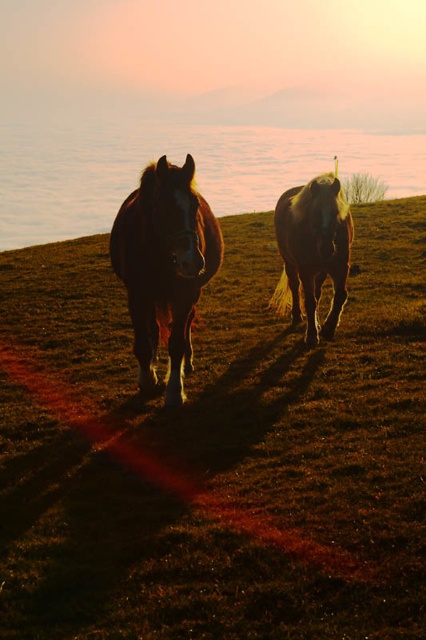
You are standing in the middle of the grassy hill where the two horses are walking. You want to take a photo that includes both points marked as point 1 at (37, 216) and point 2 at (288, 234). Which point should you focus on first to ensure both are in focus?

You should focus on point 1 at (37, 216) first because it is closer to you than point 2 at (288, 234). Since point 1 is closer, focusing on it will ensure that point 2, which is further away, remains in focus as well.

You are a photographer standing in the field. You want to take a photo of the shiny brown horse at right without the translucent glass water at center appearing in the foreground. Is this possible?

The translucent glass water at center is positioned over the shiny brown horse at right, so it will block the view of the horse. Therefore, you cannot take a photo of the shiny brown horse at right without the translucent glass water at center appearing in the foreground.

From the picture: You are a photographer planning to capture the two horses in the scene. Given that you want to focus on the brown grassy at center and the translucent glass water at center, which one should you prioritize framing more prominently in your composition?

You should prioritize framing the translucent glass water at center more prominently because it occupies more space than the brown grassy at center according to the scene description.